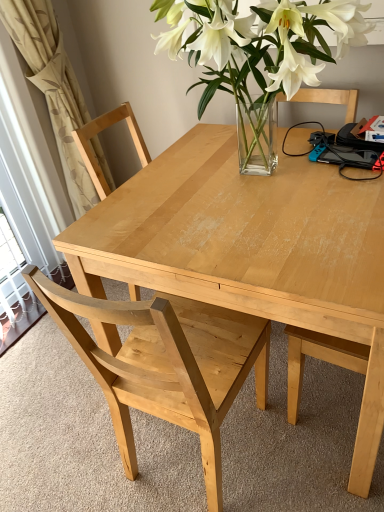
You are a GUI agent. You are given a task and a screenshot of the screen. Output one action in this format:
    pyautogui.click(x=<x>, y=<y>)
    Task: Click on the beige fabric curtain at left
    
    Given the screenshot: What is the action you would take?
    pyautogui.click(x=53, y=87)

Measure the distance between point (x=323, y=170) and camera.

The depth of point (x=323, y=170) is 4.25 feet.

At what (x,y) coordinates should I click in order to perform the action: click on natural wood table at center. Please return your answer as a coordinate pair (x, y). Looking at the image, I should click on point(250,250).

The image size is (384, 512). Identify the location of light wood chair at center. (166, 364).

Where is `kitchen & dining room table on the right of beige fabric curtain at left`? The height and width of the screenshot is (512, 384). kitchen & dining room table on the right of beige fabric curtain at left is located at coordinates point(250,250).

Between beige fabric curtain at left and natural wood table at center, which one has smaller width?

With smaller width is beige fabric curtain at left.

Does beige fabric curtain at left have a larger size compared to natural wood table at center?

No, beige fabric curtain at left is not bigger than natural wood table at center.

Measure the distance between beige fabric curtain at left and natural wood table at center.

beige fabric curtain at left is 37.75 inches from natural wood table at center.

Could you tell me if light wood chair at center is turned towards natural wood table at center?

Yes, light wood chair at center is oriented towards natural wood table at center.

Is light wood chair at center positioned before natural wood table at center?

Yes.

Can you see light wood chair at center touching natural wood table at center?

There is a gap between light wood chair at center and natural wood table at center.

Does point (143, 361) lie in front of point (46, 81)?

That is True.

From a real-world perspective, is light wood chair at center located higher than beige fabric curtain at left?

Incorrect, from a real-world perspective, light wood chair at center is lower than beige fabric curtain at left.

Is light wood chair at center not within beige fabric curtain at left?

light wood chair at center lies outside beige fabric curtain at left's area.

Is light wood chair at center bigger or smaller than beige fabric curtain at left?

Considering their sizes, light wood chair at center takes up more space than beige fabric curtain at left.

Looking at this image, which object is further away from the camera taking this photo, beige fabric curtain at left or light wood chair at center?

beige fabric curtain at left is more distant.

Is beige fabric curtain at left touching light wood chair at center?

beige fabric curtain at left and light wood chair at center are not in contact.

From a real-world perspective, is beige fabric curtain at left physically located above or below light wood chair at center?

From a real-world perspective, beige fabric curtain at left is physically above light wood chair at center.

Does natural wood table at center lie behind light wood chair at center?

Yes, it is.

Which of these two, natural wood table at center or light wood chair at center, is thinner?

Thinner between the two is light wood chair at center.

Is natural wood table at center at the right side of light wood chair at center?

Yes, natural wood table at center is to the right of light wood chair at center.

Is natural wood table at center taller than beige fabric curtain at left?

In fact, natural wood table at center may be shorter than beige fabric curtain at left.

Considering the sizes of objects natural wood table at center and beige fabric curtain at left in the image provided, who is bigger, natural wood table at center or beige fabric curtain at left?

With larger size is natural wood table at center.

Is natural wood table at center facing away from beige fabric curtain at left?

No, beige fabric curtain at left is not at the back of natural wood table at center.

Which is behind, natural wood table at center or beige fabric curtain at left?

beige fabric curtain at left is behind.

The image size is (384, 512). I want to click on kitchen & dining room table on the right of beige fabric curtain at left, so click(x=250, y=250).

Find the location of a particular element. This screenshot has height=512, width=384. chair above the natural wood table at center (from a real-world perspective) is located at coordinates (166, 364).

When comparing their distances from beige fabric curtain at left, does natural wood table at center or light wood chair at center seem closer?

natural wood table at center lies closer to beige fabric curtain at left than the other object.

Which object lies nearer to the anchor point natural wood table at center, light wood chair at center or beige fabric curtain at left?

The object closer to natural wood table at center is light wood chair at center.

Looking at this image, estimate the real-world distances between objects in this image. Which object is closer to light wood chair at center, beige fabric curtain at left or natural wood table at center?

The object closer to light wood chair at center is natural wood table at center.

Considering their positions, is natural wood table at center positioned further to light wood chair at center than beige fabric curtain at left?

Based on the image, beige fabric curtain at left appears to be further to light wood chair at center.

Considering their positions, is light wood chair at center positioned further to beige fabric curtain at left than natural wood table at center?

light wood chair at center is further to beige fabric curtain at left.

Which object lies nearer to the anchor point natural wood table at center, beige fabric curtain at left or light wood chair at center?

Among the two, light wood chair at center is located nearer to natural wood table at center.

This screenshot has width=384, height=512. Find the location of `chair between beige fabric curtain at left and natural wood table at center from left to right`. chair between beige fabric curtain at left and natural wood table at center from left to right is located at coordinates (166, 364).